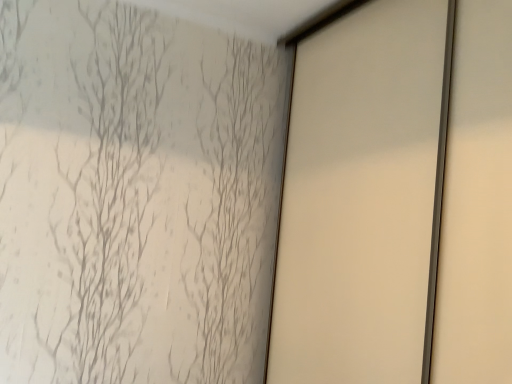
Measure the distance between point (314, 351) and camera.

5.41 feet.

This screenshot has width=512, height=384. What do you see at coordinates (362, 198) in the screenshot?
I see `matte white door at center` at bounding box center [362, 198].

Find the location of a particular element. matte white door at center is located at coordinates (362, 198).

Image resolution: width=512 pixels, height=384 pixels. Find the location of `matte white door at center`. matte white door at center is located at coordinates (362, 198).